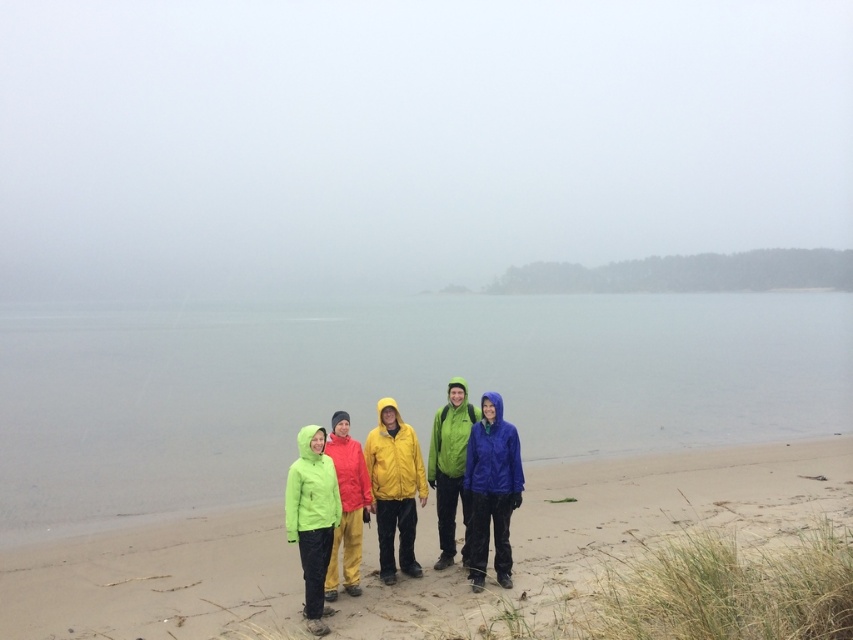
You are standing on the beach and want to take a photo of the point at coordinates point (119, 445). If your camera can focus up to 20 meters away, will you be able to capture the point clearly?

The distance of point (119, 445) from the camera is 17.43 meters, which is within the camera focus range of 20 meters. Therefore, you can capture the point clearly.

You are standing at the point with coordinates (491,490) on the beach. What color raincoat is right at your current position?

The point at (491,490) has a matte blue raincoat at center located there.